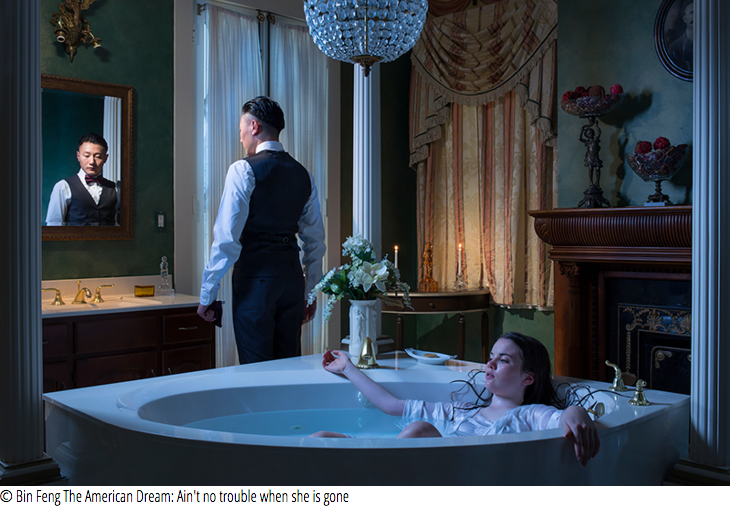
This screenshot has width=732, height=515. Identify the location of light. (392, 244), (457, 245), (203, 143).